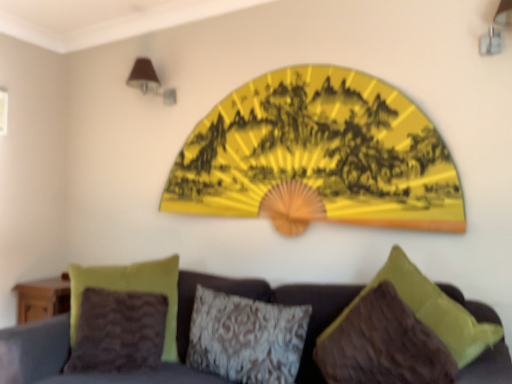
Question: From the image's perspective, is velvet brown pillow at lower left, which is the 1th pillow from left to right, located above yellow paper fan at upper center?

Choices:
 (A) yes
 (B) no

Answer: (B)

Question: Can you confirm if velvet brown pillow at lower left, the 3th pillow from the right, is positioned to the right of yellow paper fan at upper center?

Choices:
 (A) no
 (B) yes

Answer: (A)

Question: From a real-world perspective, is velvet brown pillow at lower left, which is the 1th pillow from left to right, below yellow paper fan at upper center?

Choices:
 (A) yes
 (B) no

Answer: (A)

Question: Is velvet brown pillow at lower left, which is the 1th pillow from left to right, facing away from yellow paper fan at upper center?

Choices:
 (A) yes
 (B) no

Answer: (B)

Question: Is velvet brown pillow at lower left, which is the 1th pillow from left to right, wider than yellow paper fan at upper center?

Choices:
 (A) no
 (B) yes

Answer: (B)

Question: From the image's perspective, is velvet brown pillow at lower left, which is the 1th pillow from left to right, below yellow paper fan at upper center?

Choices:
 (A) no
 (B) yes

Answer: (B)

Question: Considering the relative sizes of brown fuzzy pillow at lower right, marked as the 1th pillow in a right-to-left arrangement, and yellow paper fan at upper center in the image provided, is brown fuzzy pillow at lower right, marked as the 1th pillow in a right-to-left arrangement, wider than yellow paper fan at upper center?

Choices:
 (A) no
 (B) yes

Answer: (B)

Question: Is brown fuzzy pillow at lower right, which ranks as the 3th pillow in left-to-right order, completely or partially outside of yellow paper fan at upper center?

Choices:
 (A) yes
 (B) no

Answer: (A)

Question: From a real-world perspective, is brown fuzzy pillow at lower right, marked as the 1th pillow in a right-to-left arrangement, physically above yellow paper fan at upper center?

Choices:
 (A) yes
 (B) no

Answer: (B)

Question: Are brown fuzzy pillow at lower right, which ranks as the 3th pillow in left-to-right order, and yellow paper fan at upper center far apart?

Choices:
 (A) yes
 (B) no

Answer: (B)

Question: From the image's perspective, is brown fuzzy pillow at lower right, marked as the 1th pillow in a right-to-left arrangement, on top of yellow paper fan at upper center?

Choices:
 (A) no
 (B) yes

Answer: (A)

Question: Is brown fuzzy pillow at lower right, marked as the 1th pillow in a right-to-left arrangement, positioned in front of yellow paper fan at upper center?

Choices:
 (A) yes
 (B) no

Answer: (A)

Question: Considering the relative positions of brown fabric lampshade at upper left and velvet fabric couch at center in the image provided, is brown fabric lampshade at upper left behind velvet fabric couch at center?

Choices:
 (A) yes
 (B) no

Answer: (A)